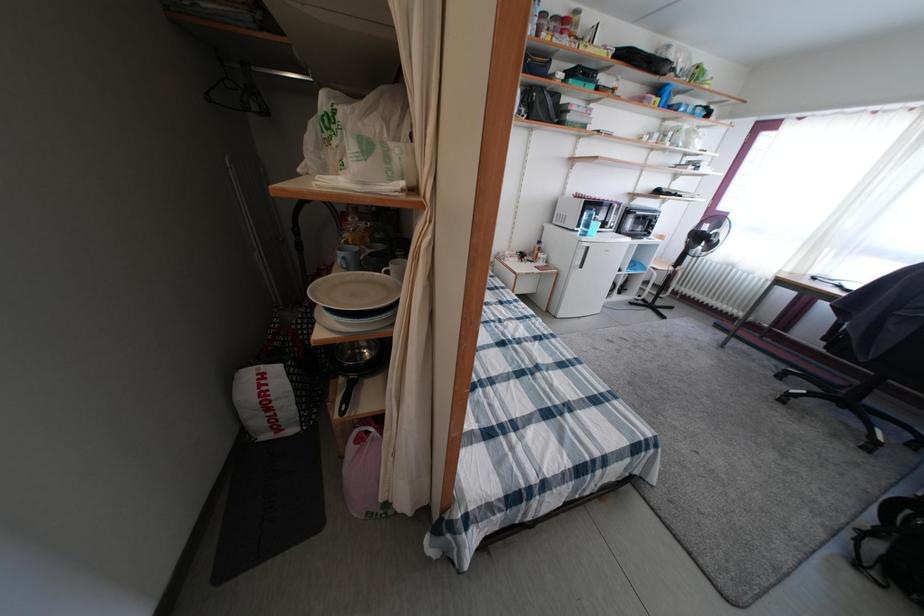
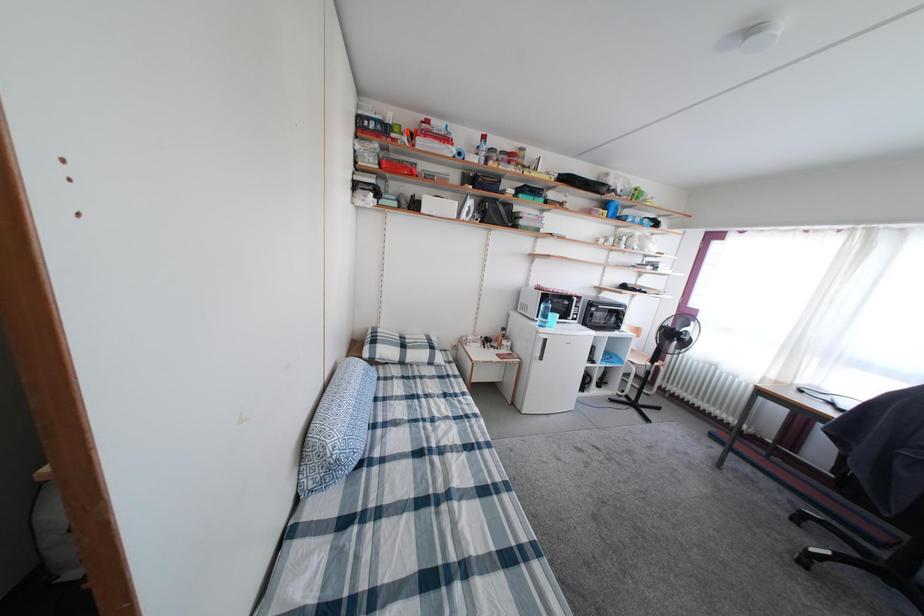
Question: In a continuous first-person perspective shot, in which direction is the camera moving?

Choices:
 (A) Left
 (B) Right
 (C) Forward
 (D) Backward

Answer: (B)